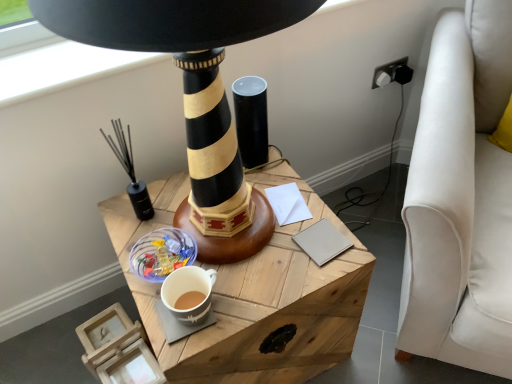
Identify the location of vacant space in front of white paper at center, which is the 1th notepad from back to front. The height and width of the screenshot is (384, 512). (283, 257).